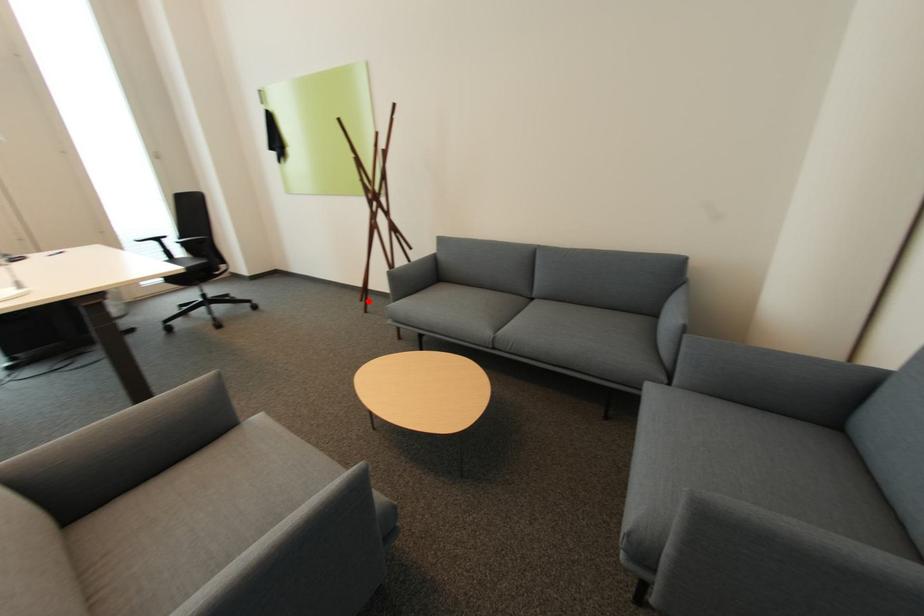
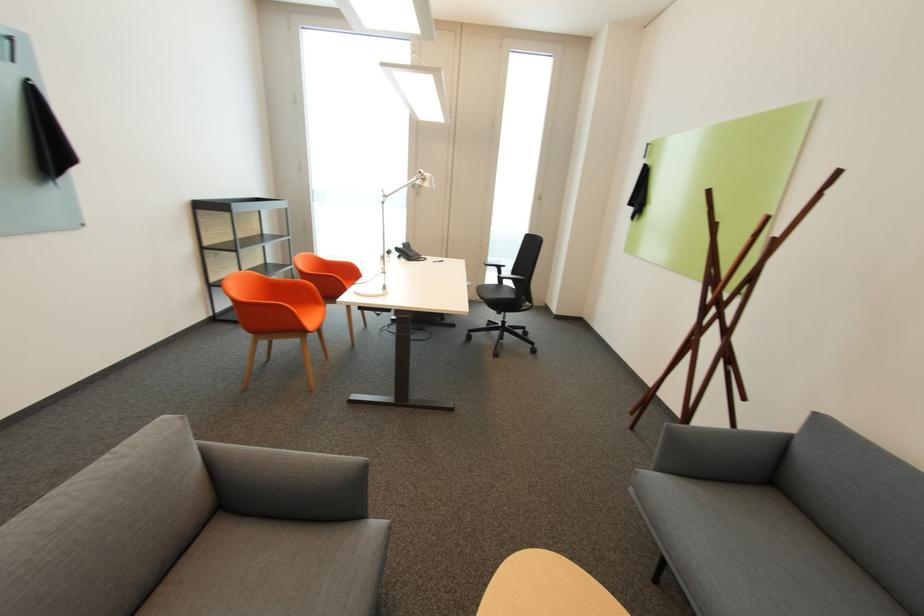
Find the pixel in the second image that matches the highlighted location in the first image.

(638, 414)